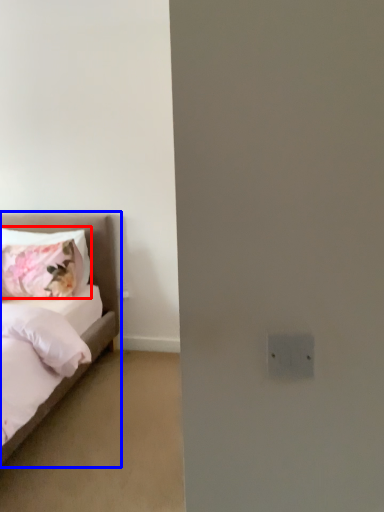
Question: Among these objects, which one is nearest to the camera, pillow (highlighted by a red box) or bed (highlighted by a blue box)?

Choices:
 (A) pillow
 (B) bed

Answer: (B)